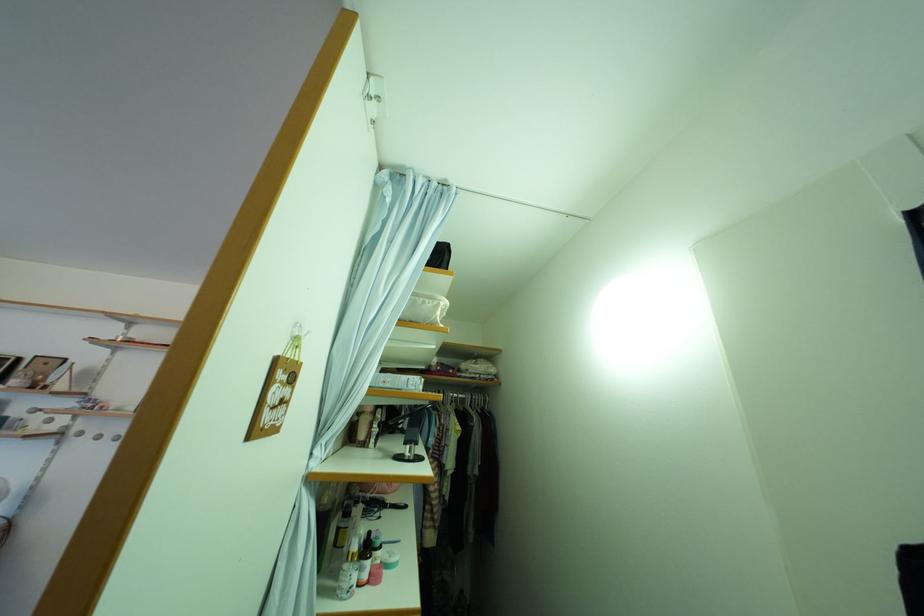
Find where to lift the white cardboard box. Please return your answer as a coordinate pair (x, y).

(407, 354)